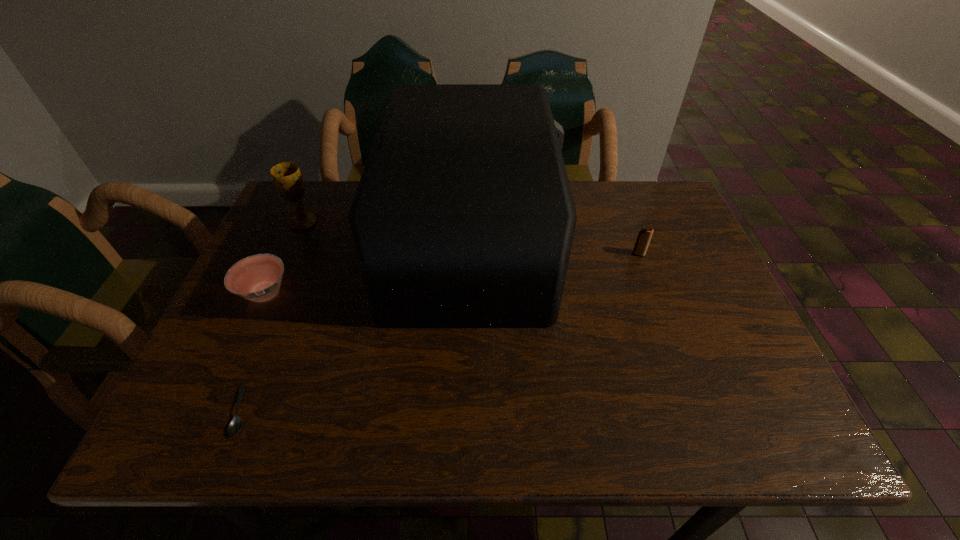
What are the coordinates of `vacant point located 0.230m on the left of the rightmost object` in the screenshot? It's located at (543, 254).

Where is `blank area located on the right of the second shortest object`? blank area located on the right of the second shortest object is located at coordinates (461, 293).

Image resolution: width=960 pixels, height=540 pixels. I want to click on vacant space positioned 0.180m on the right of the nearest object, so click(346, 410).

Where is `microwave oven located at the far edge`? microwave oven located at the far edge is located at coordinates (463, 217).

Image resolution: width=960 pixels, height=540 pixels. I want to click on chalice present at the far edge, so click(x=287, y=178).

Find the location of a particular element. object positioned at the near edge is located at coordinates click(x=235, y=425).

Where is `chalice that is at the left edge`? This screenshot has width=960, height=540. chalice that is at the left edge is located at coordinates (287, 178).

In order to click on bowl that is positioned at the left edge in this screenshot , I will do `click(258, 277)`.

The height and width of the screenshot is (540, 960). I want to click on soupspoon located at the left edge, so click(x=235, y=425).

You are a GUI agent. You are given a task and a screenshot of the screen. Output one action in this format:
    pyautogui.click(x=<x>, y=<y>)
    Task: Click on the object that is at the right edge
    Image resolution: width=960 pixels, height=540 pixels.
    Given the screenshot: What is the action you would take?
    pyautogui.click(x=644, y=236)